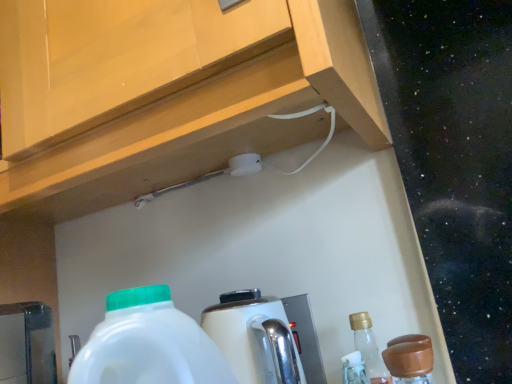
Question: Does white glossy coffee machine at center have a greater width compared to brown matte bottle at lower right?

Choices:
 (A) no
 (B) yes

Answer: (B)

Question: From the image's perspective, is white glossy coffee machine at center beneath brown matte bottle at lower right?

Choices:
 (A) yes
 (B) no

Answer: (B)

Question: Is white glossy coffee machine at center oriented away from brown matte bottle at lower right?

Choices:
 (A) yes
 (B) no

Answer: (B)

Question: From a real-world perspective, is white glossy coffee machine at center on brown matte bottle at lower right?

Choices:
 (A) no
 (B) yes

Answer: (B)

Question: Does white glossy coffee machine at center have a lesser width compared to brown matte bottle at lower right?

Choices:
 (A) yes
 (B) no

Answer: (B)

Question: Is white glossy coffee machine at center aimed at brown matte bottle at lower right?

Choices:
 (A) yes
 (B) no

Answer: (B)

Question: Could you tell me if brown matte bottle at lower right is turned towards white glossy coffee machine at center?

Choices:
 (A) yes
 (B) no

Answer: (B)

Question: From a real-world perspective, does brown matte bottle at lower right sit lower than white glossy coffee machine at center?

Choices:
 (A) yes
 (B) no

Answer: (A)

Question: Is brown matte bottle at lower right directly adjacent to white glossy coffee machine at center?

Choices:
 (A) no
 (B) yes

Answer: (A)

Question: Considering the relative sizes of brown matte bottle at lower right and white glossy coffee machine at center in the image provided, is brown matte bottle at lower right wider than white glossy coffee machine at center?

Choices:
 (A) yes
 (B) no

Answer: (B)

Question: Considering the relative positions of brown matte bottle at lower right and white glossy coffee machine at center in the image provided, is brown matte bottle at lower right to the left of white glossy coffee machine at center from the viewer's perspective?

Choices:
 (A) no
 (B) yes

Answer: (A)

Question: Is white glossy coffee machine at center at the back of brown matte bottle at lower right?

Choices:
 (A) no
 (B) yes

Answer: (A)

Question: In terms of width, does brown matte bottle at lower right look wider or thinner when compared to white glossy coffee machine at center?

Choices:
 (A) thin
 (B) wide

Answer: (A)